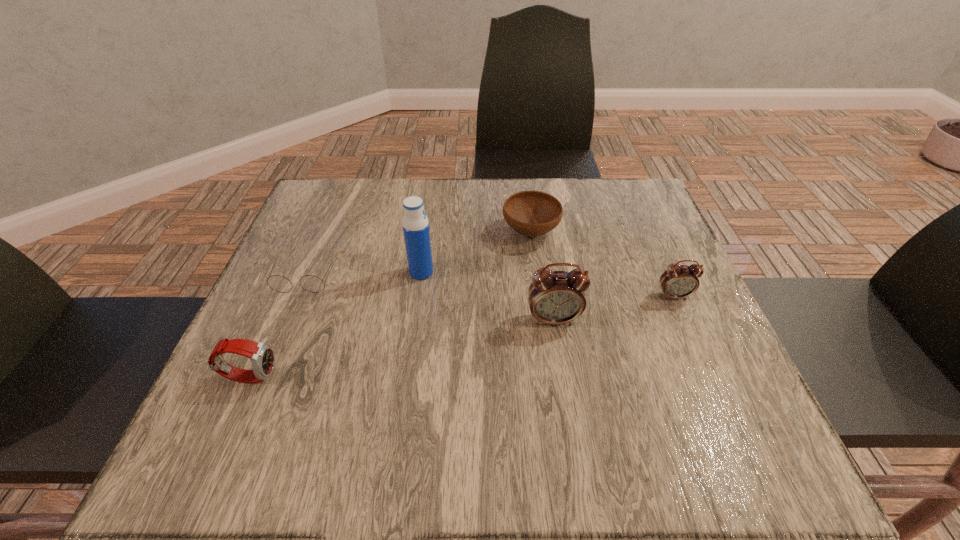
Image resolution: width=960 pixels, height=540 pixels. In order to click on object that is positioned at the right edge in this screenshot , I will do `click(679, 281)`.

Where is `object located at the near left corner`? object located at the near left corner is located at coordinates (262, 357).

Where is `vacant space at the far edge`? vacant space at the far edge is located at coordinates (379, 195).

This screenshot has height=540, width=960. In order to click on vacant space at the near edge of the desktop in this screenshot , I will do `click(640, 416)`.

You are a GUI agent. You are given a task and a screenshot of the screen. Output one action in this format:
    pyautogui.click(x=<x>, y=<y>)
    Task: Click on the vacant area at the left edge of the desktop
    The image size is (960, 540).
    Given the screenshot: What is the action you would take?
    pyautogui.click(x=256, y=337)

In the image, there is a desktop. What are the coordinates of `free region at the far right corner` in the screenshot? It's located at (644, 201).

The image size is (960, 540). In the image, there is a desktop. Identify the location of vacant space at the near right corner. (687, 374).

Where is `free space between the fifth shortest object and the water bottle`? This screenshot has width=960, height=540. free space between the fifth shortest object and the water bottle is located at coordinates (488, 296).

Locate an element on the screen. free area in between the spectacles and the watch is located at coordinates [x=278, y=325].

Where is `empty location between the nearest object and the fifth shortest object`? empty location between the nearest object and the fifth shortest object is located at coordinates (402, 348).